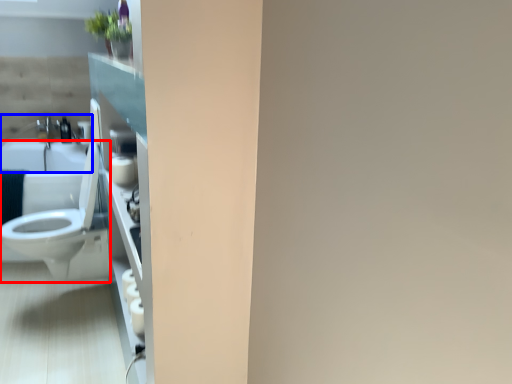
Question: Which object is further to the camera taking this photo, toilet (highlighted by a red box) or sink (highlighted by a blue box)?

Choices:
 (A) toilet
 (B) sink

Answer: (B)